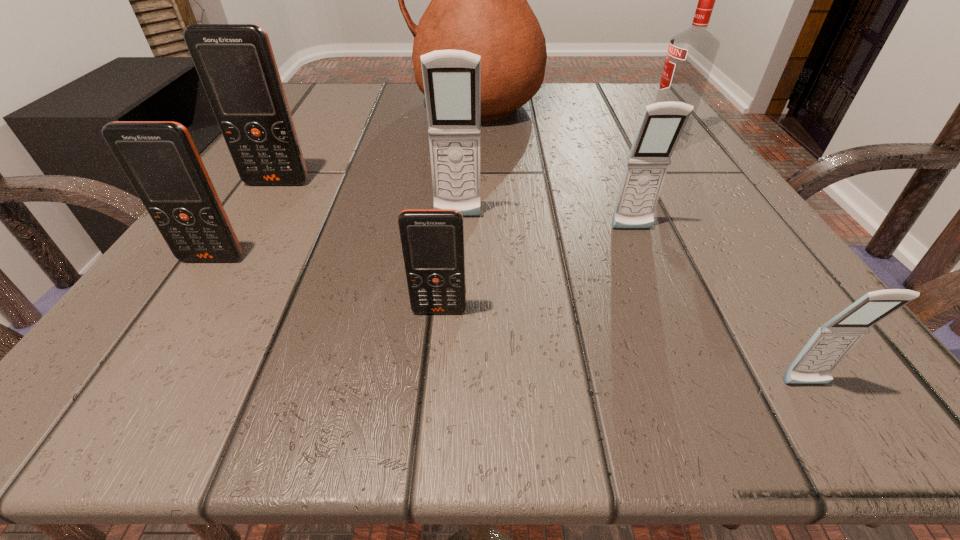
Identify the location of pitcher. (478, 4).

Where is `vodka`? This screenshot has height=540, width=960. vodka is located at coordinates (691, 54).

Identify the location of the biggest gray cellular telephone. (452, 78).

You are a GUI agent. You are given a task and a screenshot of the screen. Output one action in this format:
    pyautogui.click(x=<x>, y=<y>)
    Task: Click on the farthest gray cellular telephone
    The image size is (960, 540).
    Given the screenshot: What is the action you would take?
    pyautogui.click(x=452, y=78)

Where is `the farthest orange cellular telephone`? the farthest orange cellular telephone is located at coordinates (235, 62).

Locate an element on the screen. the farthest cellular telephone is located at coordinates (235, 62).

Find the location of `the second gray cellular telephone from right to left`. the second gray cellular telephone from right to left is located at coordinates (662, 123).

Where is `the third object from right to left`? This screenshot has height=540, width=960. the third object from right to left is located at coordinates (662, 123).

This screenshot has width=960, height=540. I want to click on the fourth farthest cellular telephone, so click(160, 159).

The width and height of the screenshot is (960, 540). Identify the location of the second smallest orange cellular telephone. (160, 159).